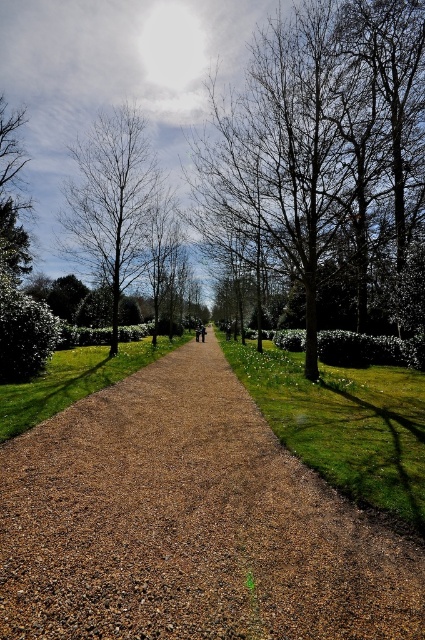
Who is taller, brown leafless tree at center or brown leafless tree at upper left?

With more height is brown leafless tree at center.

Does brown leafless tree at center appear under brown leafless tree at upper left?

No, brown leafless tree at center is not below brown leafless tree at upper left.

Between point (414, 198) and point (138, 216), which one is positioned behind?

Positioned behind is point (414, 198).

Identify the location of brown leafless tree at center. The image size is (425, 640). (319, 141).

Is brown gravel path at center smaller than brown leafless tree at upper left?

No, brown gravel path at center is not smaller than brown leafless tree at upper left.

Which is more to the left, brown gravel path at center or brown leafless tree at upper left?

brown leafless tree at upper left is more to the left.

Identify the location of brown gravel path at center. (189, 524).

The image size is (425, 640). Identify the location of brown gravel path at center. (189, 524).

Is brown gravel path at center above brown leafless tree at center?

No, brown gravel path at center is not above brown leafless tree at center.

Between brown gravel path at center and brown leafless tree at center, which one appears on the right side from the viewer's perspective?

From the viewer's perspective, brown leafless tree at center appears more on the right side.

Does point (255, 611) come closer to viewer compared to point (334, 16)?

That is True.

The image size is (425, 640). Find the location of `brown gravel path at center`. brown gravel path at center is located at coordinates (189, 524).